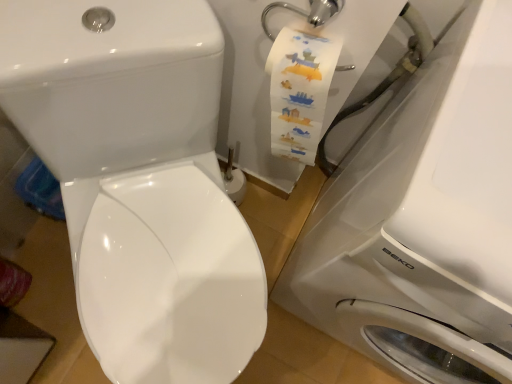
Question: In the image, is white glossy washing machine at right on the left side or the right side of white glossy toilet at center?

Choices:
 (A) right
 (B) left

Answer: (A)

Question: Is point (507, 253) positioned closer to the camera than point (143, 334)?

Choices:
 (A) farther
 (B) closer

Answer: (B)

Question: From the image's perspective, relative to white glossy toilet at center, is white glossy washing machine at right above or below?

Choices:
 (A) below
 (B) above

Answer: (A)

Question: Choose the correct answer: Is white glossy toilet at center inside white glossy washing machine at right or outside it?

Choices:
 (A) outside
 (B) inside

Answer: (A)

Question: Is point (159, 301) positioned closer to the camera than point (389, 337)?

Choices:
 (A) closer
 (B) farther

Answer: (A)

Question: Looking at the image, does white glossy toilet at center seem bigger or smaller compared to white glossy washing machine at right?

Choices:
 (A) big
 (B) small

Answer: (B)

Question: Considering the relative positions of white glossy toilet at center and white glossy washing machine at right in the image provided, is white glossy toilet at center to the left or to the right of white glossy washing machine at right?

Choices:
 (A) left
 (B) right

Answer: (A)